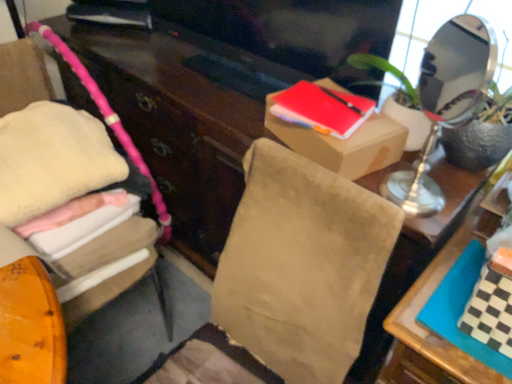
Question: Is green textured plant at upper right to the right of soft pink fabric at left from the viewer's perspective?

Choices:
 (A) no
 (B) yes

Answer: (B)

Question: Considering the relative sizes of green textured plant at upper right and soft pink fabric at left in the image provided, is green textured plant at upper right shorter than soft pink fabric at left?

Choices:
 (A) no
 (B) yes

Answer: (B)

Question: Does green textured plant at upper right have a larger size compared to soft pink fabric at left?

Choices:
 (A) yes
 (B) no

Answer: (B)

Question: From the image's perspective, is green textured plant at upper right over soft pink fabric at left?

Choices:
 (A) yes
 (B) no

Answer: (A)

Question: From the image's perspective, is green textured plant at upper right located beneath soft pink fabric at left?

Choices:
 (A) no
 (B) yes

Answer: (A)

Question: From their relative heights in the image, would you say soft pink fabric at left is taller or shorter than matte cardboard box at upper right?

Choices:
 (A) short
 (B) tall

Answer: (B)

Question: Is soft pink fabric at left in front of or behind matte cardboard box at upper right in the image?

Choices:
 (A) front
 (B) behind

Answer: (A)

Question: Visually, is soft pink fabric at left positioned to the left or to the right of matte cardboard box at upper right?

Choices:
 (A) left
 (B) right

Answer: (A)

Question: From the image's perspective, is soft pink fabric at left located above or below matte cardboard box at upper right?

Choices:
 (A) above
 (B) below

Answer: (B)

Question: From a real-world perspective, is green textured plant at upper right physically located above or below checkerboard-patterned book at right, the second book from the left?

Choices:
 (A) below
 (B) above

Answer: (B)

Question: Does point 501,135 appear closer or farther from the camera than point 501,258?

Choices:
 (A) farther
 (B) closer

Answer: (A)

Question: Looking at their shapes, would you say green textured plant at upper right is wider or thinner than checkerboard-patterned book at right, which is the 2th book in back-to-front order?

Choices:
 (A) wide
 (B) thin

Answer: (B)

Question: Would you say green textured plant at upper right is to the left or to the right of checkerboard-patterned book at right, which is the 2th book in back-to-front order, in the picture?

Choices:
 (A) left
 (B) right

Answer: (A)

Question: Considering the positions of matte red notebook at upper center, the second book from the right, and matte cardboard box at upper right in the image, is matte red notebook at upper center, the second book from the right, bigger or smaller than matte cardboard box at upper right?

Choices:
 (A) small
 (B) big

Answer: (A)

Question: From the image's perspective, is matte red notebook at upper center, which is counted as the first book, starting from the top, above or below matte cardboard box at upper right?

Choices:
 (A) below
 (B) above

Answer: (B)